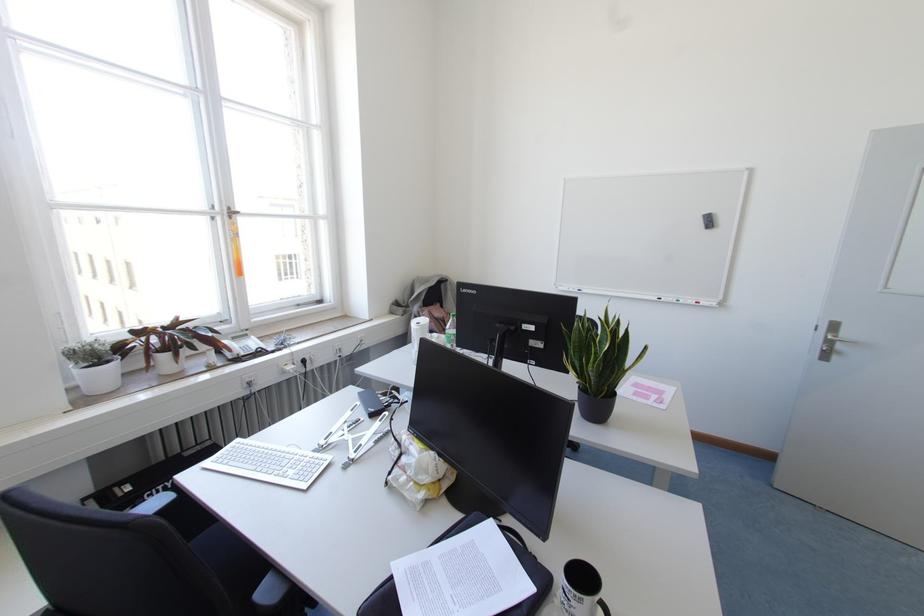
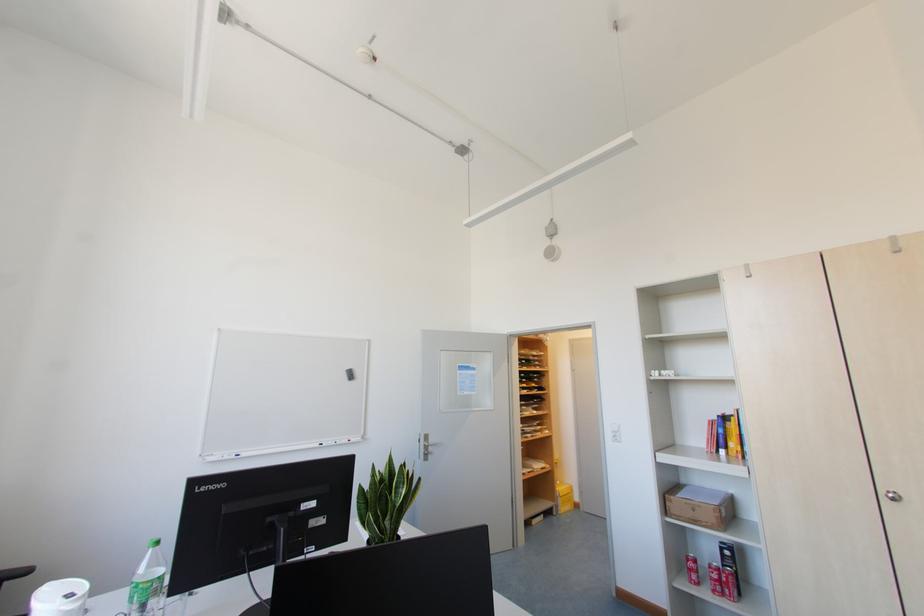
Question: The images are taken continuously from a first-person perspective. In which direction is your viewpoint rotating?

Choices:
 (A) Left
 (B) Right
 (C) Up
 (D) Down

Answer: (B)